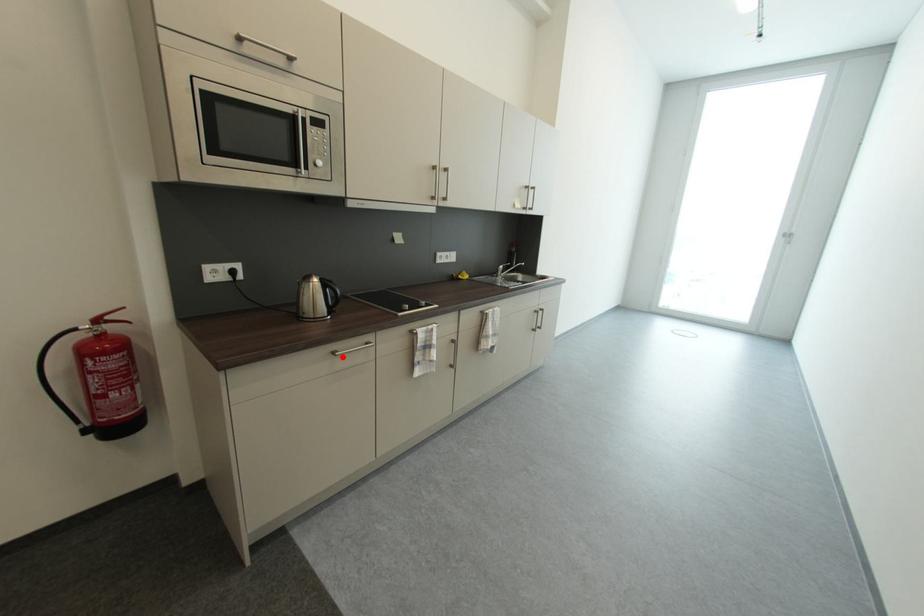
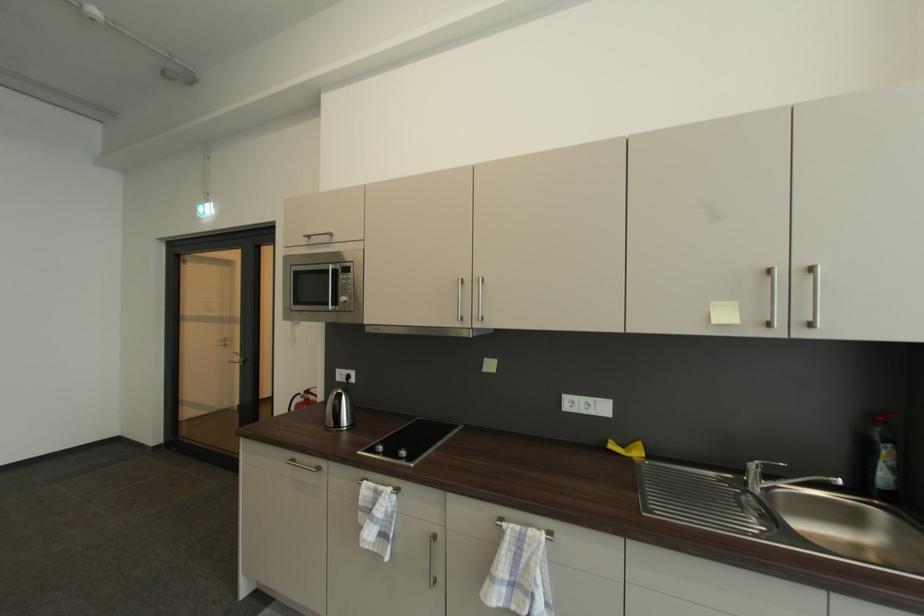
Find the pixel in the second image that matches the highlighted location in the first image.

(295, 464)